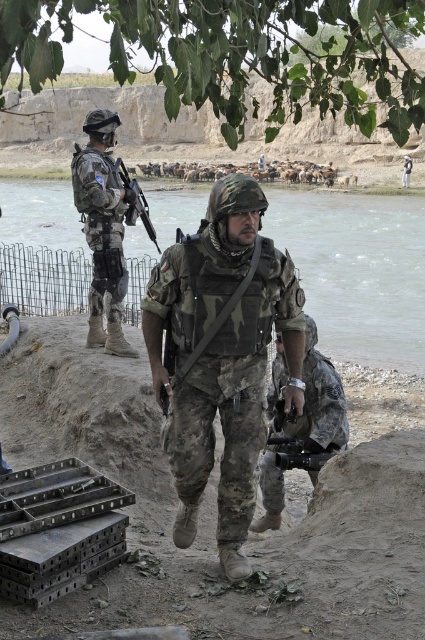
Does point (266, 273) come farther from viewer compared to point (124, 196)?

No, it is in front of (124, 196).

Between camouflage fabric uniform at center and black plastic rifle at upper center, which one appears on the right side from the viewer's perspective?

camouflage fabric uniform at center is more to the right.

Is point (176, 417) farther from viewer compared to point (118, 160)?

No, (176, 417) is closer to viewer.

Find the location of `camouflage fabric uniform at center`. camouflage fabric uniform at center is located at coordinates (221, 356).

What do you see at coordinates (221, 356) in the screenshot?
I see `camouflage fabric uniform at center` at bounding box center [221, 356].

Does camouflage fabric uniform at center appear over camouflage fabric uniform at left?

No, camouflage fabric uniform at center is not above camouflage fabric uniform at left.

This screenshot has height=640, width=425. In order to click on camouflage fabric uniform at center in this screenshot , I will do `click(221, 356)`.

In the scene shown: Is clear water at river right to the left of camouflage fabric uniform at left from the viewer's perspective?

In fact, clear water at river right is to the right of camouflage fabric uniform at left.

Between clear water at river right and camouflage fabric uniform at left, which one has more height?

With more height is clear water at river right.

Describe the element at coordinates (357, 269) in the screenshot. This screenshot has height=640, width=425. I see `clear water at river right` at that location.

You are a GUI agent. You are given a task and a screenshot of the screen. Output one action in this format:
    pyautogui.click(x=<x>, y=<y>)
    Task: Click on the clear water at river right
    Image resolution: width=425 pixels, height=640 pixels.
    Given the screenshot: What is the action you would take?
    pyautogui.click(x=357, y=269)